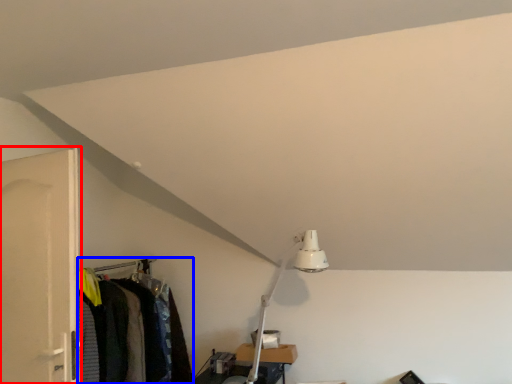
Question: Which of the following is the closest to the observer, door (highlighted by a red box) or closet (highlighted by a blue box)?

Choices:
 (A) door
 (B) closet

Answer: (A)